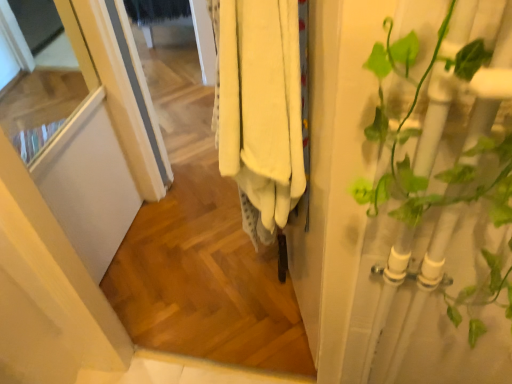
Question: Would you say green leafy plant at right is inside or outside white cotton towels at center?

Choices:
 (A) outside
 (B) inside

Answer: (A)

Question: From the image's perspective, is green leafy plant at right positioned above or below white cotton towels at center?

Choices:
 (A) above
 (B) below

Answer: (B)

Question: Estimate the real-world distances between objects in this image. Which object is closer to the white matte screen door at left?

Choices:
 (A) white cotton towels at center
 (B) green leafy plant at right

Answer: (A)

Question: Estimate the real-world distances between objects in this image. Which object is closer to the green leafy plant at right?

Choices:
 (A) white matte screen door at left
 (B) white cotton towels at center

Answer: (B)